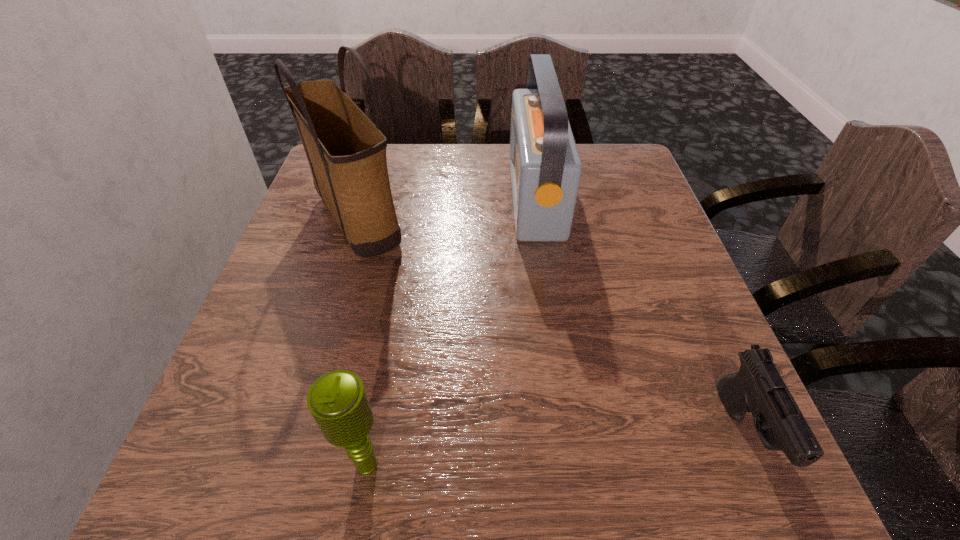
The height and width of the screenshot is (540, 960). Identify the location of the tallest object. (346, 152).

The height and width of the screenshot is (540, 960). What are the coordinates of `the second tallest object` in the screenshot? It's located at (545, 166).

Identify the location of radio receiver. The image size is (960, 540). (545, 166).

This screenshot has width=960, height=540. What are the coordinates of `microphone` in the screenshot? It's located at (337, 400).

Image resolution: width=960 pixels, height=540 pixels. In order to click on the shortest object in this screenshot , I will do `click(758, 387)`.

The image size is (960, 540). I want to click on the rightmost object, so click(758, 387).

Image resolution: width=960 pixels, height=540 pixels. In order to click on vacant space located on the back of the tallest object in this screenshot , I will do `click(380, 145)`.

At what (x,y) coordinates should I click in order to perform the action: click on vacant space situated on the front-facing side of the second object from right to left. Please return your answer as a coordinate pair (x, y). This screenshot has width=960, height=540. Looking at the image, I should click on (354, 197).

At what (x,y) coordinates should I click in order to perform the action: click on free space located on the front-facing side of the second object from right to left. Please return your answer as a coordinate pair (x, y). Image resolution: width=960 pixels, height=540 pixels. Looking at the image, I should click on (451, 197).

Identify the location of vacant space situated on the front-facing side of the second object from right to left. (444, 197).